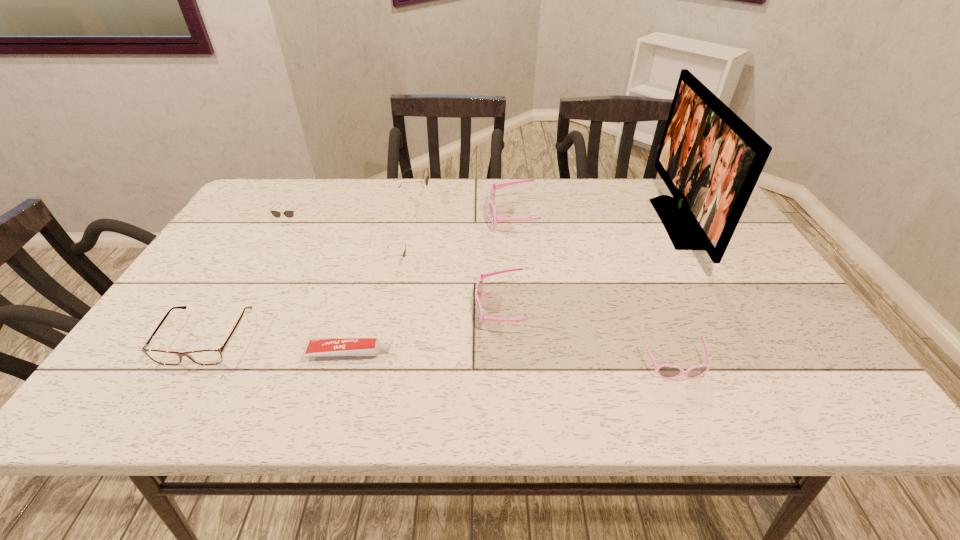
In the image, there is a desktop. Find the location of `free region at the right edge`. free region at the right edge is located at coordinates (830, 361).

Locate an element on the screen. This screenshot has width=960, height=540. free space at the far left corner of the desktop is located at coordinates (252, 200).

Image resolution: width=960 pixels, height=540 pixels. In order to click on vacant point located between the shortest object and the second biggest pink sunglasses in this screenshot , I will do `click(424, 331)`.

Find the location of a particular element. The height and width of the screenshot is (540, 960). free area in between the shortest object and the red spectacles is located at coordinates (277, 345).

I want to click on vacant area between the red spectacles and the farthest pink sunglasses, so click(x=359, y=278).

The width and height of the screenshot is (960, 540). I want to click on vacant space that's between the red spectacles and the farthest pink sunglasses, so click(x=359, y=278).

Identify the location of free space between the second nearest pink sunglasses and the fourth farthest sunglasses. The height and width of the screenshot is (540, 960). (448, 286).

Image resolution: width=960 pixels, height=540 pixels. In order to click on empty space between the biggest pink sunglasses and the toothpaste in this screenshot , I will do (x=430, y=285).

At what (x,y) coordinates should I click in order to perform the action: click on vacant space that's between the biggest pink sunglasses and the smallest black sunglasses. Please return your answer as a coordinate pair (x, y). Looking at the image, I should click on (455, 240).

Locate an element on the screen. This screenshot has height=540, width=960. free space between the toothpaste and the rightmost object is located at coordinates (513, 288).